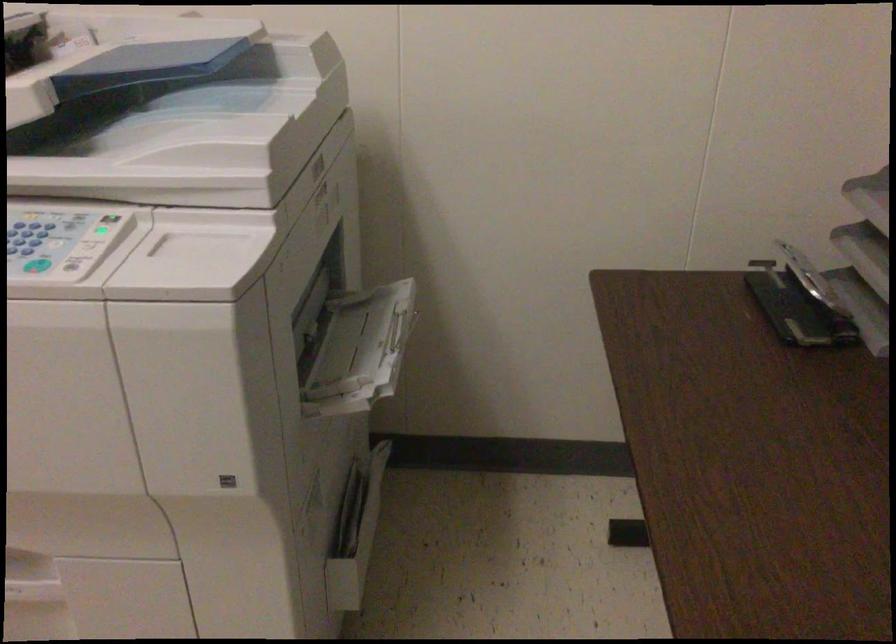
I want to click on printer access handle, so click(393, 327).